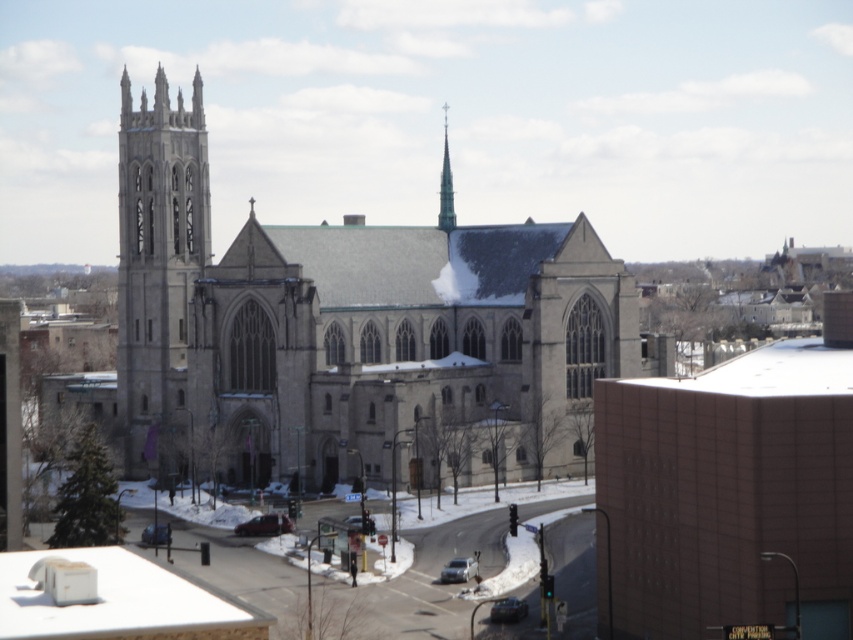
Question: Does gray stone church at center appear over green glass spire at upper center?

Choices:
 (A) no
 (B) yes

Answer: (A)

Question: Which object is closer to the camera taking this photo?

Choices:
 (A) gray stone church at center
 (B) green glass spire at upper center
 (C) gray stone tower at left

Answer: (A)

Question: Is gray stone tower at left to the left of green glass spire at upper center from the viewer's perspective?

Choices:
 (A) no
 (B) yes

Answer: (B)

Question: Which point is farther to the camera?

Choices:
 (A) pos(172,380)
 (B) pos(444,170)

Answer: (B)

Question: Considering the relative positions of gray stone tower at left and green glass spire at upper center in the image provided, where is gray stone tower at left located with respect to green glass spire at upper center?

Choices:
 (A) above
 (B) below

Answer: (B)

Question: Which of the following is the closest to the observer?

Choices:
 (A) gray stone church at center
 (B) gray stone tower at left

Answer: (A)